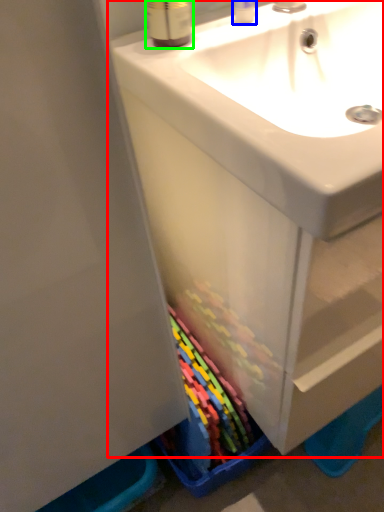
Question: Based on their relative distances, which object is farther from bathroom cabinet (highlighted by a red box)? Choose from toiletry (highlighted by a blue box) and mouthwash (highlighted by a green box).

Choices:
 (A) toiletry
 (B) mouthwash

Answer: (A)